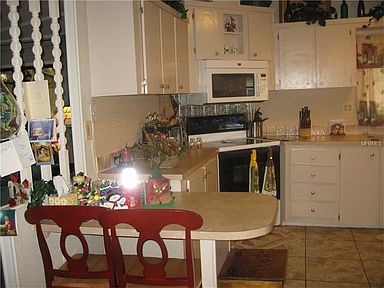
Where is `white kitchen cabinet`? The image size is (384, 288). white kitchen cabinet is located at coordinates (152, 47).